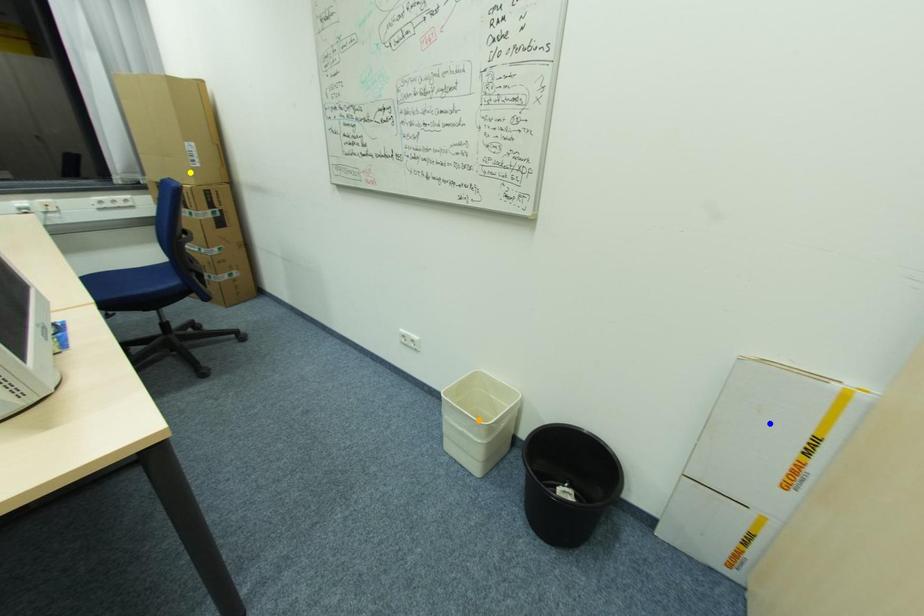
Order these from nearest to farthest:
blue point
yellow point
orange point

blue point < orange point < yellow point